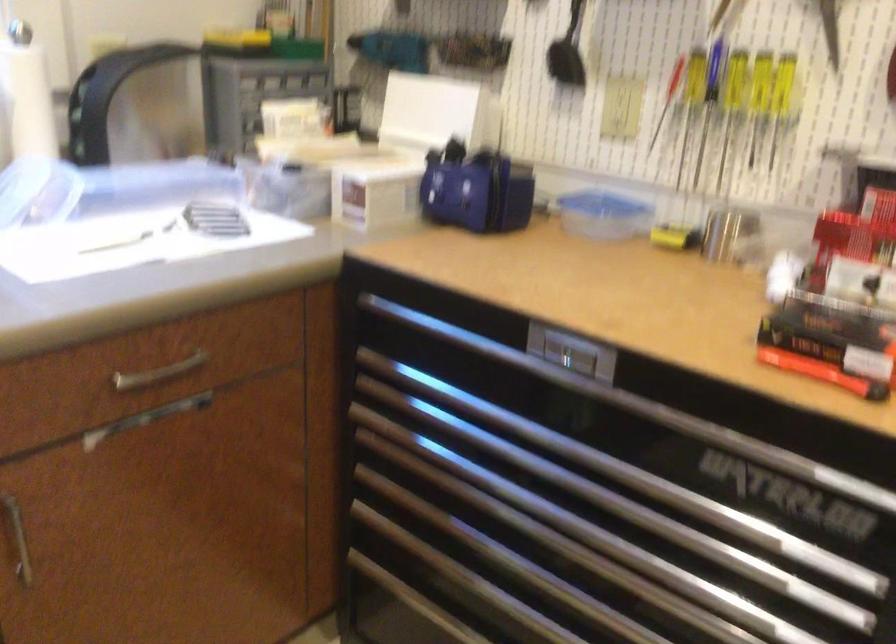
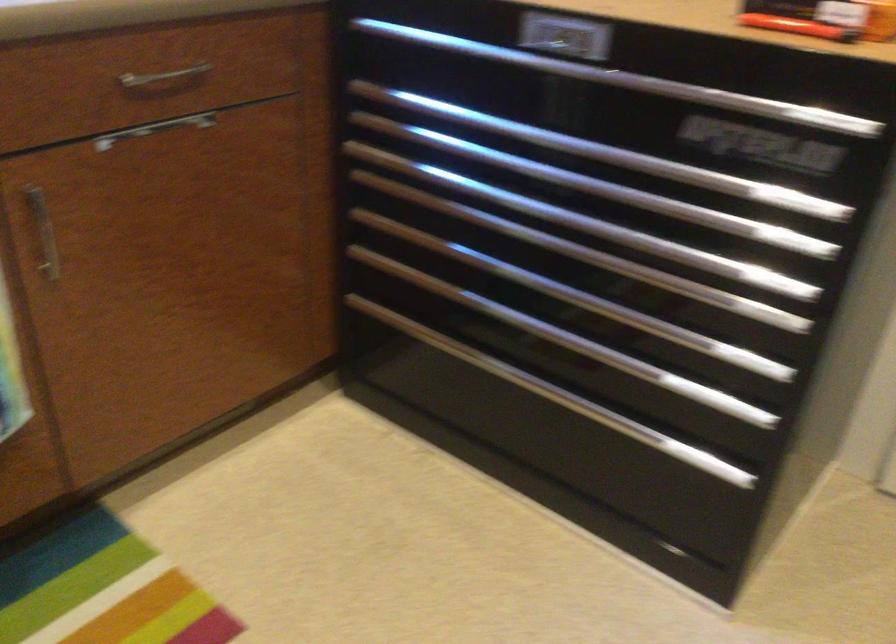
Where in the second image is the point corresponding to pixel 161 374 from the first image?

(164, 78)